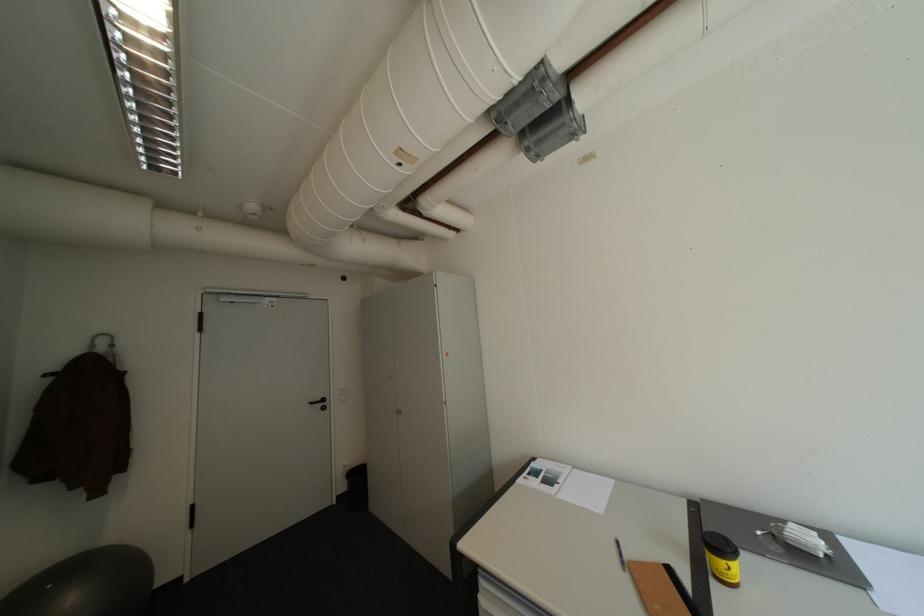
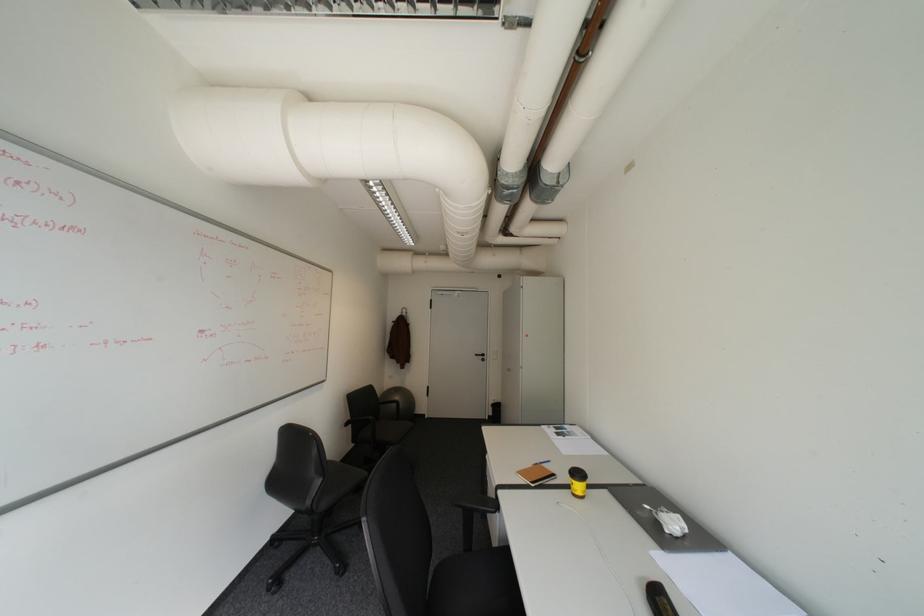
Locate, in the second image, the point that corresponds to point (634, 570) in the first image.

(543, 464)